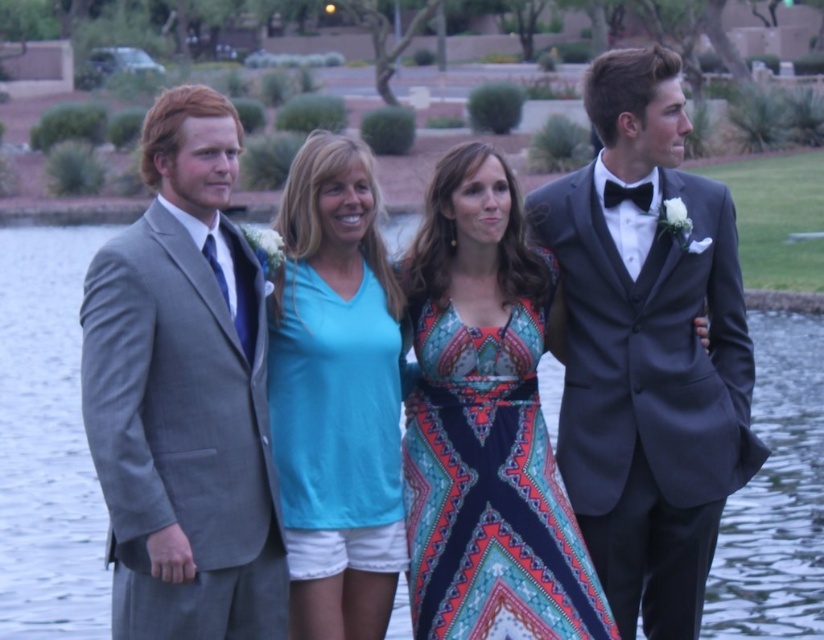
Looking at this image, is shiny black suit at right below printed fabric dress at center?

No, shiny black suit at right is not below printed fabric dress at center.

Locate an element on the screen. This screenshot has height=640, width=824. shiny black suit at right is located at coordinates (647, 349).

Which is behind, point (686, 376) or point (452, 444)?

The point (686, 376) is behind.

Locate an element on the screen. This screenshot has width=824, height=640. shiny black suit at right is located at coordinates (647, 349).

Based on the photo, between shiny black suit at right and teal fabric shirt at center, which one has less height?

teal fabric shirt at center is shorter.

Is shiny black suit at right behind teal fabric shirt at center?

Yes, shiny black suit at right is behind teal fabric shirt at center.

Which is behind, point (651, 45) or point (373, 468)?

Point (651, 45)

Find the location of a particular element. The width and height of the screenshot is (824, 640). shiny black suit at right is located at coordinates (647, 349).

Is the position of shiny black suit at right more distant than that of gray wool suit at left?

Yes, it is.

Does point (677, 177) lie behind point (176, 170)?

That is True.

Image resolution: width=824 pixels, height=640 pixels. Find the location of `shiny black suit at right`. shiny black suit at right is located at coordinates (647, 349).